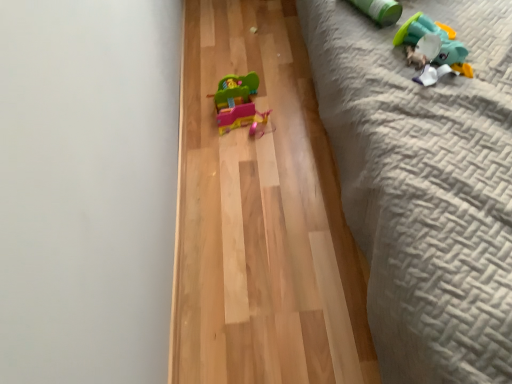
Question: Does plush green duck at upper right, placed as the 1th toy when sorted from right to left, have a smaller size compared to light brown wood flooring at center?

Choices:
 (A) no
 (B) yes

Answer: (B)

Question: Does plush green duck at upper right, which is the 3th toy in back-to-front order, have a larger size compared to light brown wood flooring at center?

Choices:
 (A) yes
 (B) no

Answer: (B)

Question: Is plush green duck at upper right, placed as the 1th toy when sorted from right to left, not near light brown wood flooring at center?

Choices:
 (A) yes
 (B) no

Answer: (B)

Question: Is plush green duck at upper right, which is the 3th toy in back-to-front order, further to camera compared to light brown wood flooring at center?

Choices:
 (A) yes
 (B) no

Answer: (A)

Question: From a real-world perspective, is plush green duck at upper right, placed as the 1th toy when sorted from right to left, over light brown wood flooring at center?

Choices:
 (A) no
 (B) yes

Answer: (B)

Question: Is light brown wood flooring at center inside plush green duck at upper right, positioned as the third toy in left-to-right order?

Choices:
 (A) no
 (B) yes

Answer: (A)

Question: Does light brown wood flooring at center touch green matte cylinder at upper right, which ranks as the 2th toy in back-to-front order?

Choices:
 (A) yes
 (B) no

Answer: (B)

Question: Is light brown wood flooring at center facing towards green matte cylinder at upper right, the 2th toy when ordered from left to right?

Choices:
 (A) no
 (B) yes

Answer: (A)

Question: Considering the relative positions of light brown wood flooring at center and green matte cylinder at upper right, which is the 2th toy in right-to-left order, in the image provided, is light brown wood flooring at center behind green matte cylinder at upper right, which is the 2th toy in right-to-left order,?

Choices:
 (A) yes
 (B) no

Answer: (B)

Question: From the image's perspective, is light brown wood flooring at center located beneath green matte cylinder at upper right, which ranks as the 2th toy in back-to-front order?

Choices:
 (A) yes
 (B) no

Answer: (A)

Question: From the image's perspective, does light brown wood flooring at center appear higher than green matte cylinder at upper right, the 2th toy when ordered from left to right?

Choices:
 (A) no
 (B) yes

Answer: (A)

Question: Considering the relative sizes of light brown wood flooring at center and green matte cylinder at upper right, which is the 2th toy in right-to-left order, in the image provided, is light brown wood flooring at center shorter than green matte cylinder at upper right, which is the 2th toy in right-to-left order,?

Choices:
 (A) no
 (B) yes

Answer: (B)

Question: Can textured gray quilt at right be found inside light brown wood flooring at center?

Choices:
 (A) yes
 (B) no

Answer: (B)